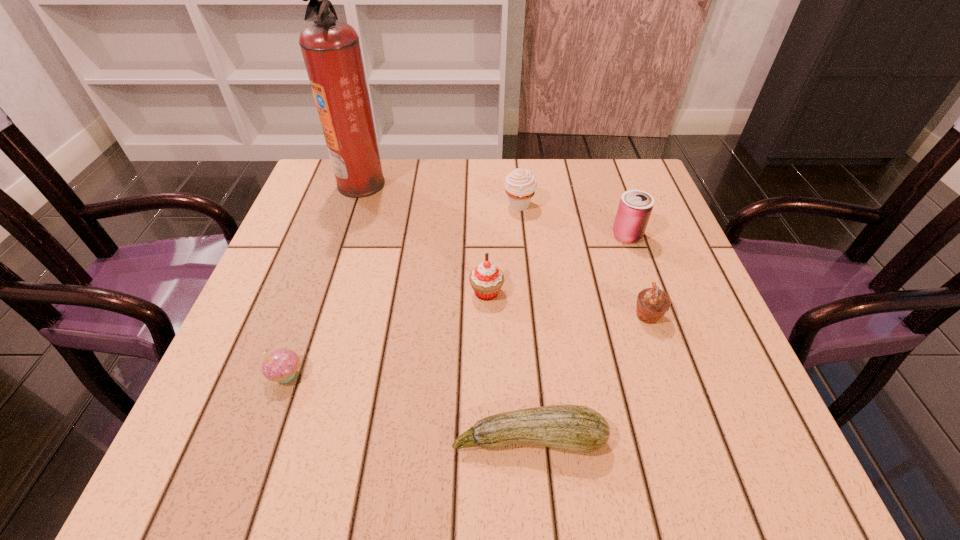
This screenshot has height=540, width=960. What are the coordinates of `the tallest object` in the screenshot? It's located at (331, 50).

At what (x,y) coordinates should I click in order to perform the action: click on the farther muffin. Please return your answer as a coordinate pair (x, y). The height and width of the screenshot is (540, 960). Looking at the image, I should click on (520, 184).

Identify the location of the left muffin. This screenshot has height=540, width=960. point(520,184).

Locate an element on the screen. This screenshot has width=960, height=540. the third farthest object is located at coordinates (635, 207).

Where is `the right cupcake`? the right cupcake is located at coordinates (486, 279).

Find the location of `the right muffin`. the right muffin is located at coordinates (652, 303).

Locate an element on the screen. the shorter muffin is located at coordinates (652, 303).

Where is `the left cupcake`? The width and height of the screenshot is (960, 540). the left cupcake is located at coordinates (281, 365).

Locate an element on the screen. The image size is (960, 540). the nearer cupcake is located at coordinates (281, 365).

You are a GUI agent. You are given a task and a screenshot of the screen. Output one action in this format:
    pyautogui.click(x=<x>, y=<y>)
    Task: Click on the shortest object
    This screenshot has height=540, width=960.
    Given the screenshot: What is the action you would take?
    pyautogui.click(x=576, y=428)